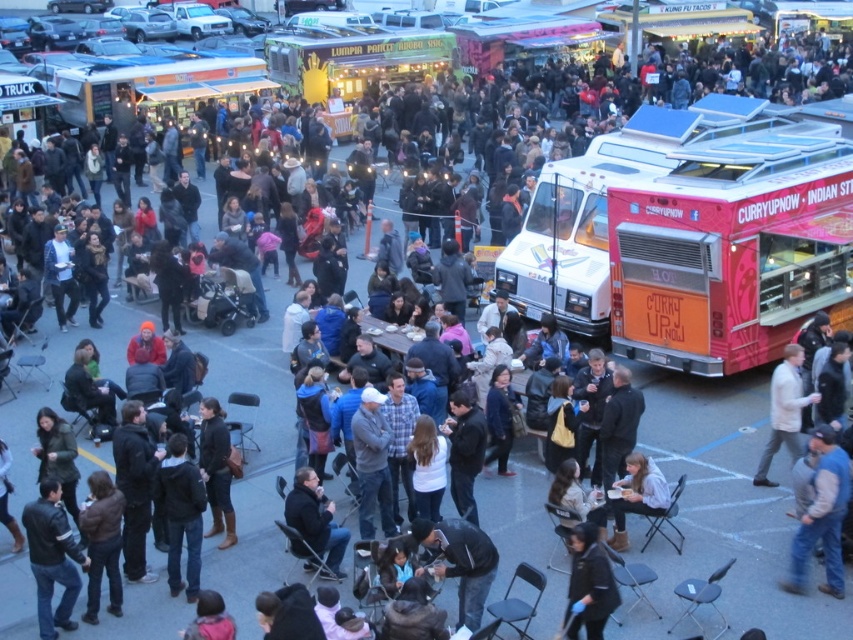
Question: Can you confirm if orange matte food truck at right is positioned to the right of white matte jacket at lower right?

Choices:
 (A) yes
 (B) no

Answer: (A)

Question: From the image, what is the correct spatial relationship of orange matte food truck at right in relation to light blue shirt at lower center?

Choices:
 (A) right
 (B) left

Answer: (A)

Question: Based on their relative distances, which object is farther from the blue denim jacket at lower right?

Choices:
 (A) white matte jacket at lower right
 (B) light blue shirt at lower center

Answer: (A)

Question: Which point is closer to the camera?

Choices:
 (A) dark gray jacket at lower center
 (B) light blue shirt at lower center
 (C) blue denim jacket at lower right

Answer: (A)

Question: Estimate the real-world distances between objects in this image. Which object is closer to the black leather jacket at lower center?

Choices:
 (A) light blue shirt at lower center
 (B) leather jacket at lower left
 (C) blue denim jacket at lower right
 (D) orange matte food truck at right

Answer: (A)

Question: Does white cotton cap at center appear on the right side of white matte jacket at lower right?

Choices:
 (A) yes
 (B) no

Answer: (B)